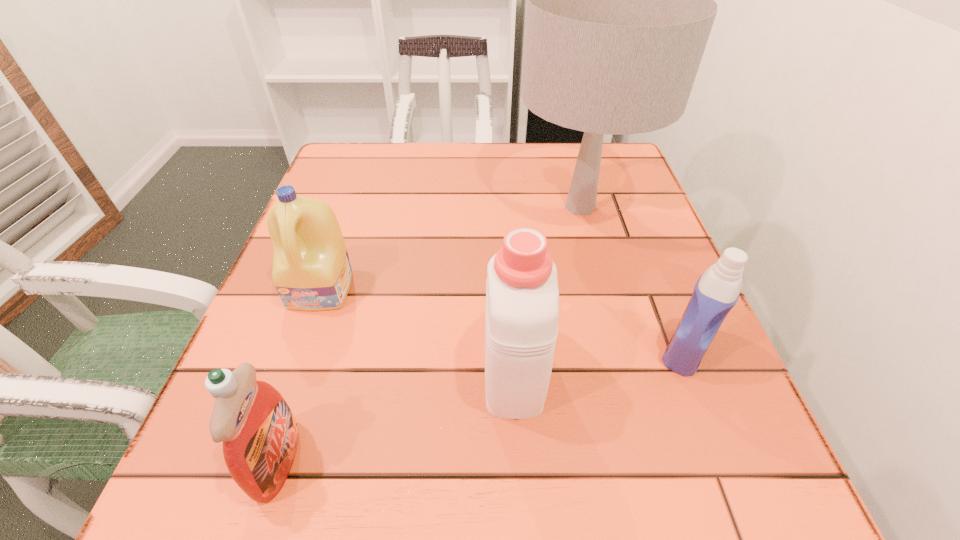
Where is `the tallest object`? The height and width of the screenshot is (540, 960). the tallest object is located at coordinates (620, 4).

At what (x,y) coordinates should I click in order to perform the action: click on lampshade. Please return your answer as a coordinate pair (x, y). Looking at the image, I should click on (620, 4).

At what (x,y) coordinates should I click in order to perform the action: click on the tallest detergent. Please return your answer as a coordinate pair (x, y). The height and width of the screenshot is (540, 960). Looking at the image, I should click on (522, 298).

At what (x,y) coordinates should I click in order to perform the action: click on the third detergent from left to right. Please return your answer as a coordinate pair (x, y). Image resolution: width=960 pixels, height=540 pixels. Looking at the image, I should click on [522, 298].

The image size is (960, 540). Find the location of `the fourth nearest object`. the fourth nearest object is located at coordinates (311, 268).

Identify the location of the rightmost detergent. (716, 292).

Locate an element on the screen. This screenshot has width=960, height=540. vacant space positioned on the front-facing side of the tallest object is located at coordinates (483, 207).

Find the location of a particular element. free space located 0.150m on the front-facing side of the tallest object is located at coordinates (447, 207).

The image size is (960, 540). Find the location of `free location located 0.310m on the front-facing side of the tallest object`. free location located 0.310m on the front-facing side of the tallest object is located at coordinates (376, 207).

Where is `free spot located 0.050m on the handle side of the tallest detergent`? Image resolution: width=960 pixels, height=540 pixels. free spot located 0.050m on the handle side of the tallest detergent is located at coordinates (509, 301).